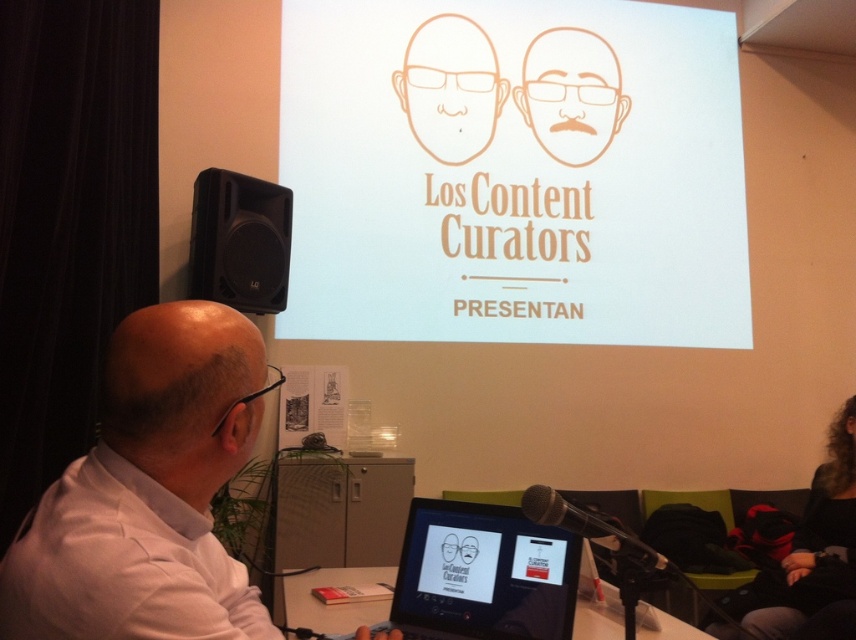
Between curly hair at lower right and black plastic table at lower center, which one has more height?

curly hair at lower right

Which is in front, point (771, 608) or point (366, 579)?

Positioned in front is point (366, 579).

You are a GUI agent. You are given a task and a screenshot of the screen. Output one action in this format:
    pyautogui.click(x=<x>, y=<y>)
    Task: Click on the curly hair at lower right
    The width and height of the screenshot is (856, 640).
    Given the screenshot: What is the action you would take?
    pyautogui.click(x=807, y=550)

This screenshot has width=856, height=640. Identify the location of curly hair at lower right. (807, 550).

Which is below, curly hair at lower right or orange line drawing face at center?

curly hair at lower right is below.

Which is more to the right, curly hair at lower right or orange line drawing face at center?

From the viewer's perspective, curly hair at lower right appears more on the right side.

The image size is (856, 640). What are the coordinates of `curly hair at lower right` in the screenshot? It's located at tap(807, 550).

Is black plastic speaker at left above black plastic table at lower center?

Correct, black plastic speaker at left is located above black plastic table at lower center.

Is point (272, 196) positioned after point (587, 634)?

Yes, point (272, 196) is farther from viewer.

Identify the location of black plastic speaker at left. This screenshot has width=856, height=640. (239, 241).